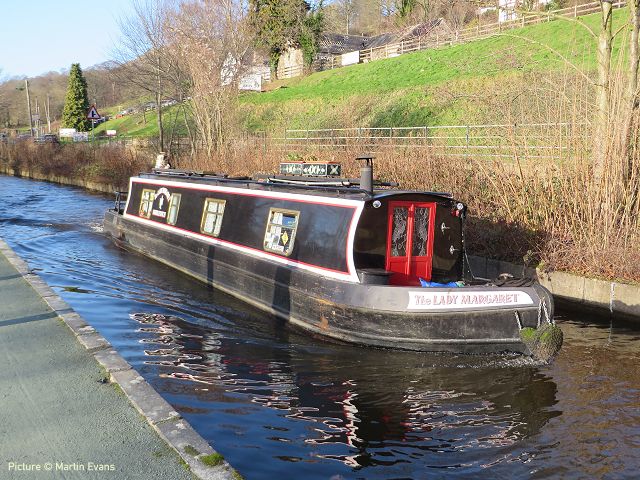
What are the coordinates of `windows` in the screenshot? It's located at (288, 219), (212, 226), (144, 203), (176, 208), (397, 226), (420, 226).